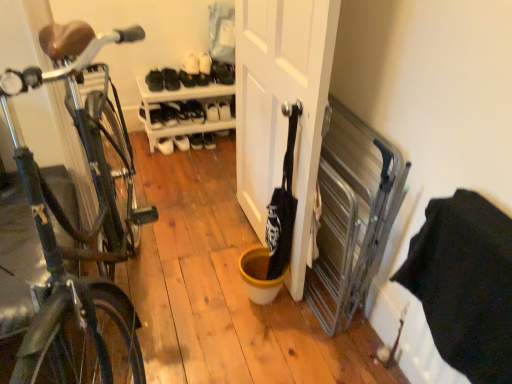
The image size is (512, 384). Find the location of `vacant space situated on the left part of white matte door at center`. vacant space situated on the left part of white matte door at center is located at coordinates (181, 254).